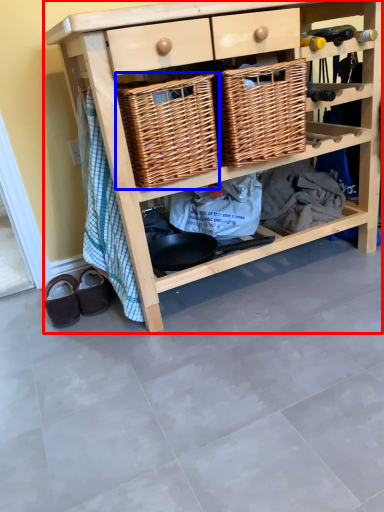
Question: Among these objects, which one is nearest to the camera, shelf (highlighted by a red box) or basket (highlighted by a blue box)?

Choices:
 (A) shelf
 (B) basket

Answer: (A)